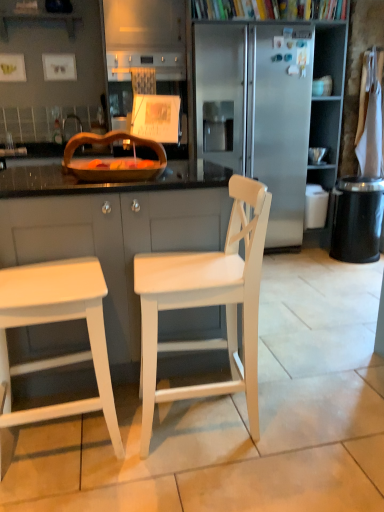
This screenshot has width=384, height=512. Identify the location of free region on the left part of black textured trash can at right. (319, 263).